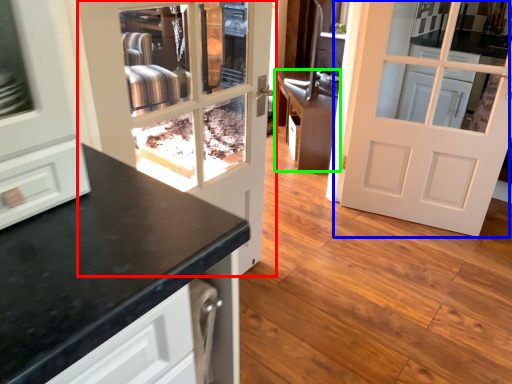
Question: Which is nearer to the door (highlighted by a red box)? door (highlighted by a blue box) or cabinetry (highlighted by a green box).

Choices:
 (A) door
 (B) cabinetry

Answer: (B)